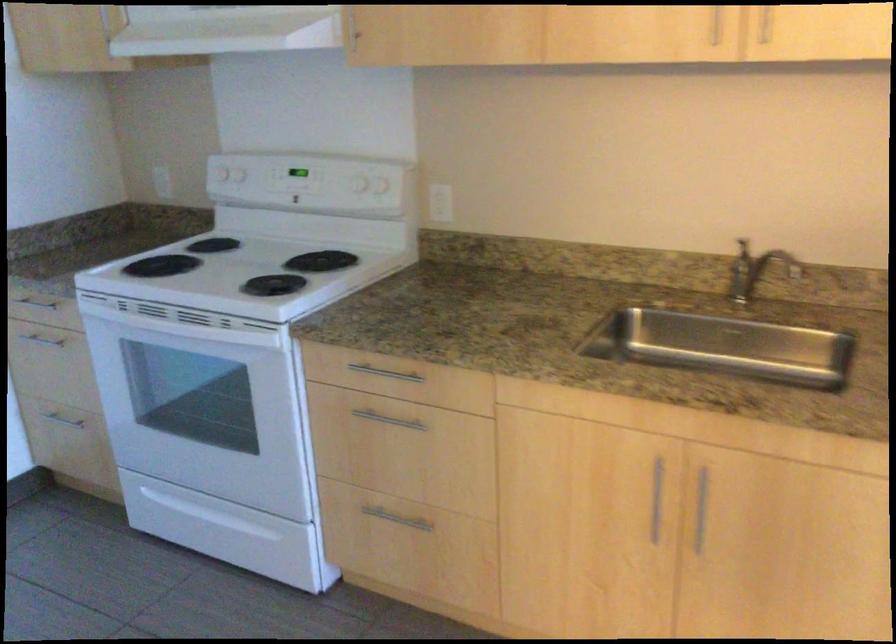
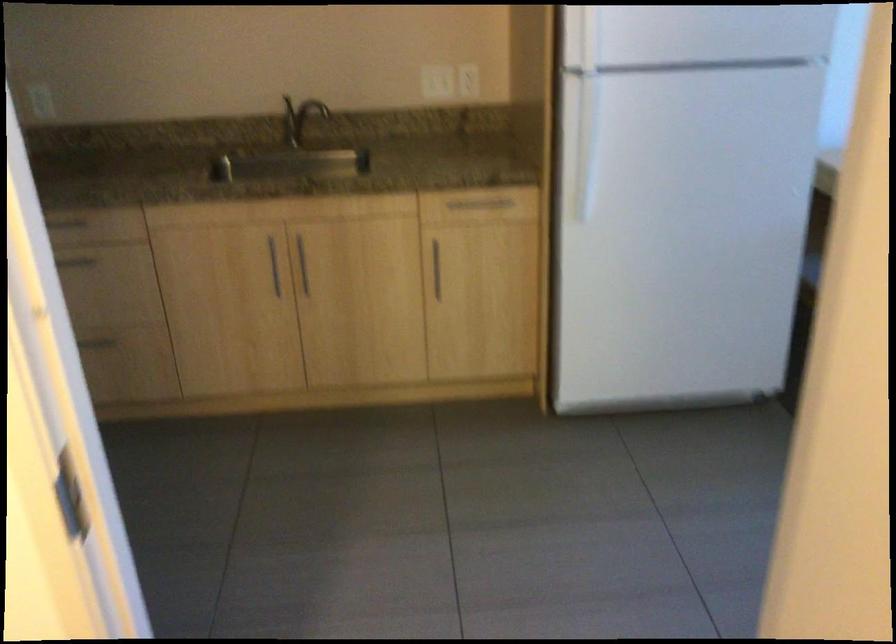
Locate, in the second image, the point that corresponds to (757,266) in the first image.

(299, 118)